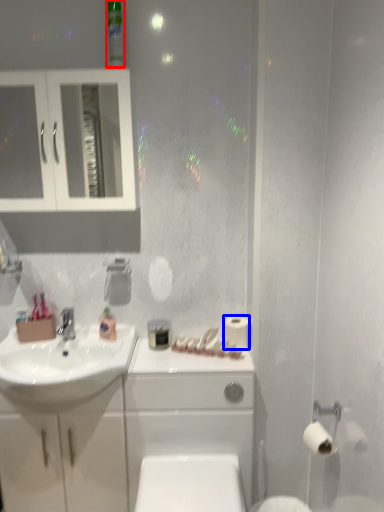
Question: Which point is further to the camera, mouthwash (highlighted by a red box) or toilet paper (highlighted by a blue box)?

Choices:
 (A) mouthwash
 (B) toilet paper

Answer: (B)